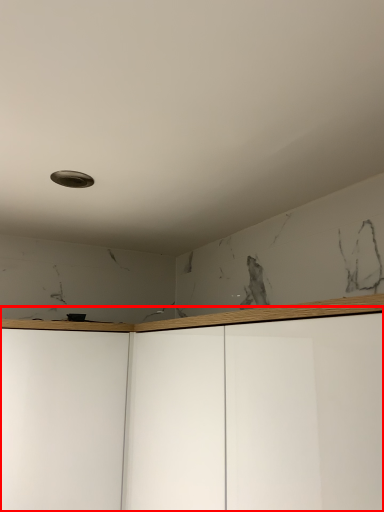
Question: From the image, what is the correct spatial relationship of dresser (annotated by the red box) in relation to glass door?

Choices:
 (A) left
 (B) right

Answer: (B)